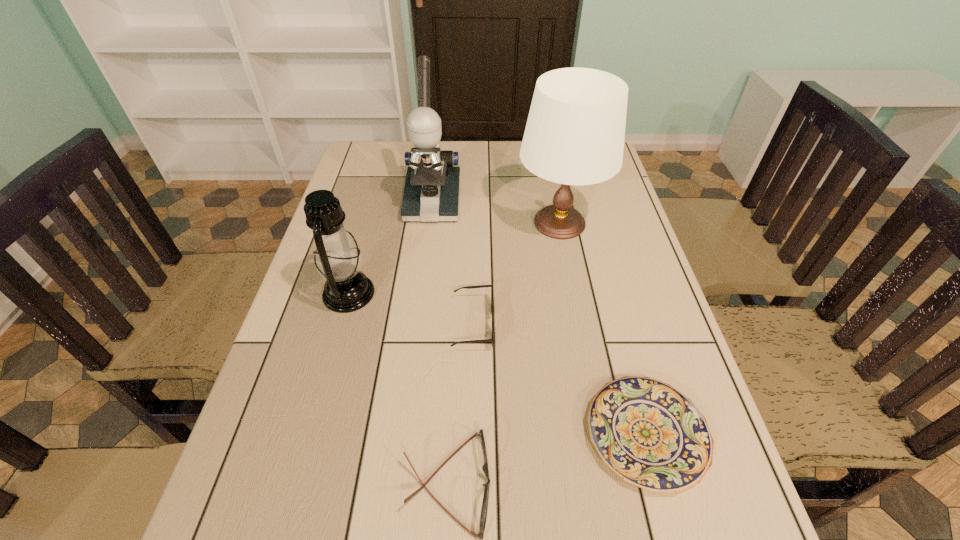
Locate an element on the screen. free spot between the microscope and the sunglasses is located at coordinates (452, 263).

This screenshot has width=960, height=540. I want to click on vacant space that is in between the lamp and the plate, so click(x=603, y=329).

I want to click on unoccupied area between the shortest object and the sunglasses, so click(560, 379).

Where is `empty space between the lamp and the shortest object`? empty space between the lamp and the shortest object is located at coordinates (603, 329).

In order to click on object that stands as the third closest to the leftmost object in this screenshot , I will do `click(482, 522)`.

Find the location of a particular element. Image resolution: width=960 pixels, height=540 pixels. object that can be found as the third closest to the sunglasses is located at coordinates (651, 435).

Locate an element on the screen. vacant area in the image that satisfies the following two spatial constraints: 1. on the front-facing side of the sunglasses; 2. on the right side of the plate is located at coordinates (471, 435).

I want to click on vacant point that satisfies the following two spatial constraints: 1. on the front-facing side of the sunglasses; 2. on the right side of the shortest object, so click(471, 435).

Where is `vacant space that satisfies the following two spatial constraints: 1. on the back side of the plate; 2. on the front-facing side of the sunglasses`? vacant space that satisfies the following two spatial constraints: 1. on the back side of the plate; 2. on the front-facing side of the sunglasses is located at coordinates [x=616, y=324].